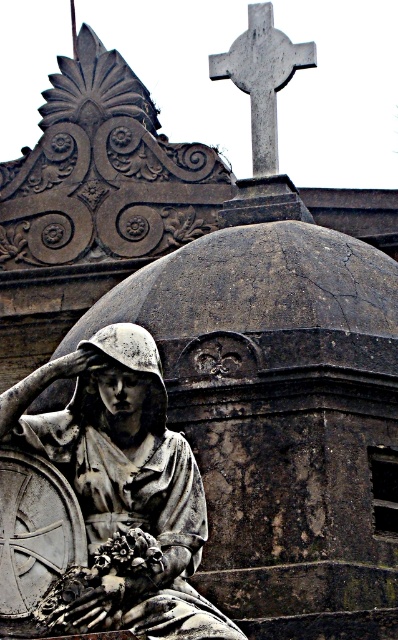
Which is more to the left, matte gray statue at center or gray stone cross at upper center?

matte gray statue at center

Which is in front, point (236, 628) or point (255, 52)?

Positioned in front is point (236, 628).

At what (x,y) coordinates should I click in order to perform the action: click on matte gray statue at center. Please return your answer as a coordinate pair (x, y). The height and width of the screenshot is (640, 398). Looking at the image, I should click on (101, 500).